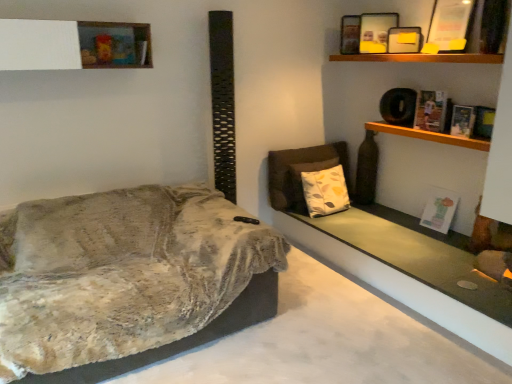
Where is `blank space situated above smooth concrete window sill at lower right (from a real-world perspective)`? blank space situated above smooth concrete window sill at lower right (from a real-world perspective) is located at coordinates (418, 243).